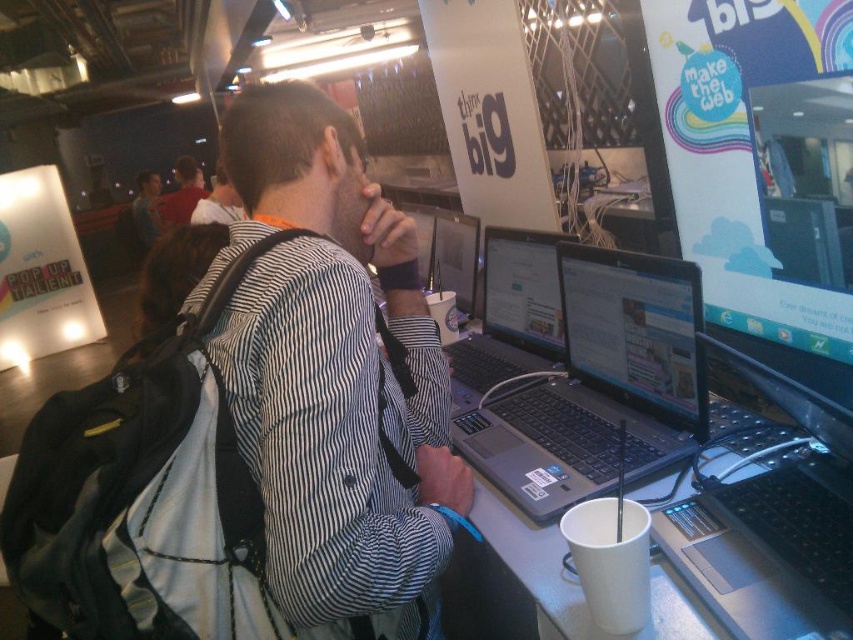
Question: Which object is the farthest from the sleek silver laptop at center?

Choices:
 (A) silver/black laptop at center
 (B) striped fabric shirt at center
 (C) dark brown leather backpack at upper left
 (D) matte black laptop at center

Answer: (C)

Question: Which point appears closest to the camera in this image?

Choices:
 (A) (583, 460)
 (B) (526, 296)
 (C) (430, 275)

Answer: (A)

Question: Which of the following is the closest to the observer?

Choices:
 (A) dark brown leather backpack at upper left
 (B) sleek silver laptop at center

Answer: (B)

Question: Can you confirm if striped fabric shirt at center is positioned to the right of matte black laptop at center?

Choices:
 (A) no
 (B) yes

Answer: (A)

Question: Where is silver/black laptop at center located in relation to sleek silver laptop at center in the image?

Choices:
 (A) right
 (B) left

Answer: (A)

Question: Can you confirm if matte black laptop at center is positioned to the left of dark brown leather backpack at upper left?

Choices:
 (A) yes
 (B) no

Answer: (B)